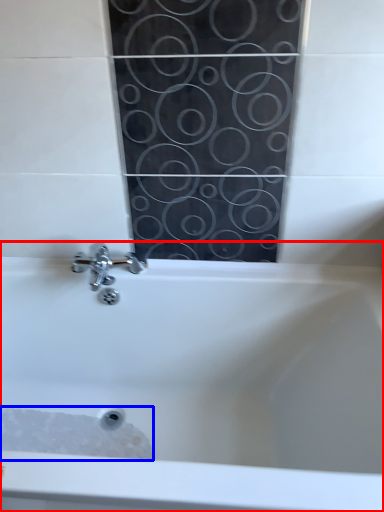
Question: Which of the following is the closest to the observer, bathtub (highlighted by a red box) or foam (highlighted by a blue box)?

Choices:
 (A) bathtub
 (B) foam

Answer: (A)